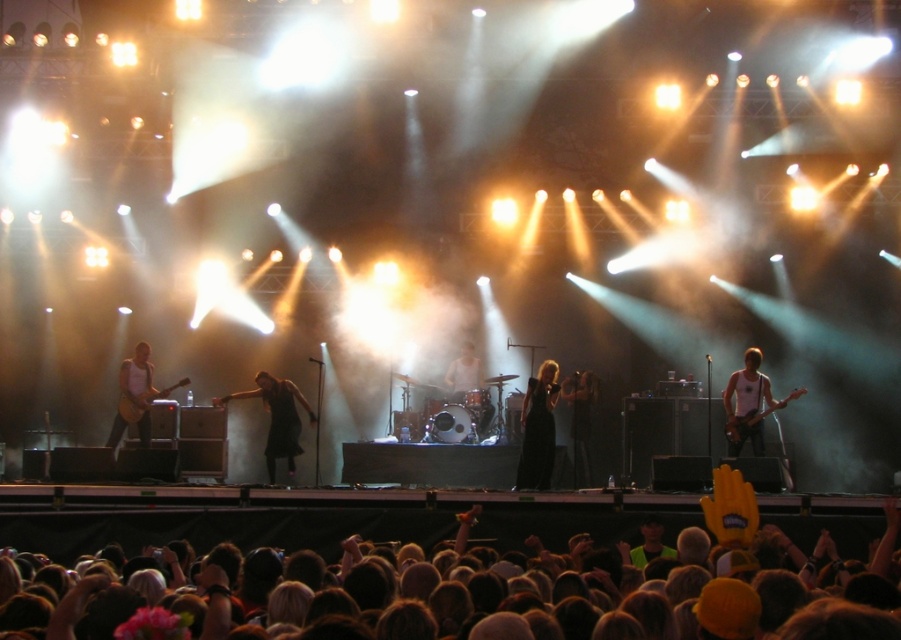
Who is higher up, white matte tank top at right or matte black guitar at left?

matte black guitar at left

Identify the location of white matte tank top at right. (747, 404).

Is point (754, 397) closer to camera compared to point (144, 412)?

That is False.

The image size is (901, 640). In order to click on white matte tank top at right in this screenshot , I will do `click(747, 404)`.

Does black leather jacket at center have a greater height compared to white matte drum set at center?

Indeed, black leather jacket at center has a greater height compared to white matte drum set at center.

Is point (574, 445) more distant than point (456, 378)?

No, (574, 445) is in front of (456, 378).

What are the coordinates of `black leather jacket at center` in the screenshot? It's located at (580, 420).

Can you confirm if white matte tank top at right is shorter than matte white tank top at left?

Yes, white matte tank top at right is shorter than matte white tank top at left.

Is white matte tank top at right wider than matte white tank top at left?

Indeed, white matte tank top at right has a greater width compared to matte white tank top at left.

Which is in front, point (729, 424) or point (132, 396)?

Point (729, 424) is in front.

Find the location of a particular element. Image resolution: width=901 pixels, height=640 pixels. white matte tank top at right is located at coordinates (747, 404).